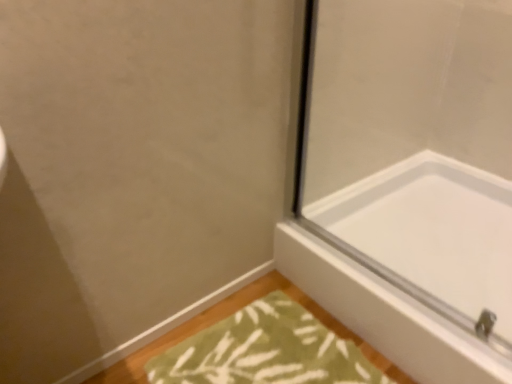
You are a GUI agent. You are given a task and a screenshot of the screen. Output one action in this format:
    pyautogui.click(x=<x>, y=<y>)
    Task: Click on the green textured bath mat at lower center
    
    Given the screenshot: What is the action you would take?
    pyautogui.click(x=265, y=350)

Measure the distance between green textured bath mat at lower center and camera.

The depth of green textured bath mat at lower center is 3.62 feet.

This screenshot has width=512, height=384. Describe the element at coordinates (265, 350) in the screenshot. I see `green textured bath mat at lower center` at that location.

What are the coordinates of `white glossy bathtub at lower right` in the screenshot? It's located at (433, 229).

Image resolution: width=512 pixels, height=384 pixels. Describe the element at coordinates (433, 229) in the screenshot. I see `white glossy bathtub at lower right` at that location.

Identify the location of green textured bath mat at lower center. (265, 350).

Can you confirm if green textured bath mat at lower center is positioned to the left of white glossy bathtub at lower right?

Indeed, green textured bath mat at lower center is positioned on the left side of white glossy bathtub at lower right.

In the image, is green textured bath mat at lower center positioned in front of or behind white glossy bathtub at lower right?

Visually, green textured bath mat at lower center is located in front of white glossy bathtub at lower right.

Is point (152, 375) positioned behind point (504, 245)?

No, (152, 375) is in front of (504, 245).

From the image's perspective, is green textured bath mat at lower center below white glossy bathtub at lower right?

Yes, from the image's perspective, green textured bath mat at lower center is below white glossy bathtub at lower right.

From a real-world perspective, who is located higher, green textured bath mat at lower center or white glossy bathtub at lower right?

white glossy bathtub at lower right, from a real-world perspective.

Which of these two, green textured bath mat at lower center or white glossy bathtub at lower right, is thinner?

green textured bath mat at lower center.

From their relative heights in the image, would you say green textured bath mat at lower center is taller or shorter than white glossy bathtub at lower right?

green textured bath mat at lower center is shorter than white glossy bathtub at lower right.

Between green textured bath mat at lower center and white glossy bathtub at lower right, which one has larger size?

white glossy bathtub at lower right.

Would you say green textured bath mat at lower center is inside or outside white glossy bathtub at lower right?

green textured bath mat at lower center exists outside the volume of white glossy bathtub at lower right.

Are green textured bath mat at lower center and white glossy bathtub at lower right far apart?

No, green textured bath mat at lower center is not far away from white glossy bathtub at lower right.

Is green textured bath mat at lower center positioned with its back to white glossy bathtub at lower right?

Yes, green textured bath mat at lower center is positioned with its back facing white glossy bathtub at lower right.

How many degrees apart are the facing directions of green textured bath mat at lower center and white glossy bathtub at lower right?

They differ by 1.65 degrees in their facing directions.

How much distance is there between green textured bath mat at lower center and white glossy bathtub at lower right?

They are 14.36 inches apart.

Find the location of `bathtub above the green textured bath mat at lower center (from a real-world perspective)`. bathtub above the green textured bath mat at lower center (from a real-world perspective) is located at coordinates (433, 229).

Is white glossy bathtub at lower right at the left side of green textured bath mat at lower center?

In fact, white glossy bathtub at lower right is to the right of green textured bath mat at lower center.

Is white glossy bathtub at lower right in front of or behind green textured bath mat at lower center in the image?

white glossy bathtub at lower right is positioned farther from the viewer than green textured bath mat at lower center.

Which is closer, (471, 235) or (287, 373)?

Clearly, point (471, 235) is more distant from the camera than point (287, 373).

In the scene shown: From the image's perspective, is white glossy bathtub at lower right under green textured bath mat at lower center?

No, from the image's perspective, white glossy bathtub at lower right is not below green textured bath mat at lower center.

From a real-world perspective, which object rests below the other?

green textured bath mat at lower center, from a real-world perspective.

Considering the sizes of white glossy bathtub at lower right and green textured bath mat at lower center in the image, is white glossy bathtub at lower right wider or thinner than green textured bath mat at lower center?

In the image, white glossy bathtub at lower right appears to be wider than green textured bath mat at lower center.

Which of these two, white glossy bathtub at lower right or green textured bath mat at lower center, stands shorter?

Standing shorter between the two is green textured bath mat at lower center.

Is white glossy bathtub at lower right smaller than green textured bath mat at lower center?

No.

Is green textured bath mat at lower center located within white glossy bathtub at lower right?

Definitely not — green textured bath mat at lower center is not inside white glossy bathtub at lower right.

Would you consider white glossy bathtub at lower right to be distant from green textured bath mat at lower center?

No.

Is white glossy bathtub at lower right oriented towards green textured bath mat at lower center?

Yes, white glossy bathtub at lower right is aimed at green textured bath mat at lower center.

What's the angular difference between white glossy bathtub at lower right and green textured bath mat at lower center's facing directions?

1.65 degrees.

Where is `bathtub above the green textured bath mat at lower center (from a real-world perspective)`? This screenshot has width=512, height=384. bathtub above the green textured bath mat at lower center (from a real-world perspective) is located at coordinates (433, 229).

Where is `bathtub on the right of the green textured bath mat at lower center`? This screenshot has height=384, width=512. bathtub on the right of the green textured bath mat at lower center is located at coordinates (433, 229).

The image size is (512, 384). In the image, there is a white glossy bathtub at lower right. In order to click on bath mat below it (from a real-world perspective) in this screenshot , I will do `click(265, 350)`.